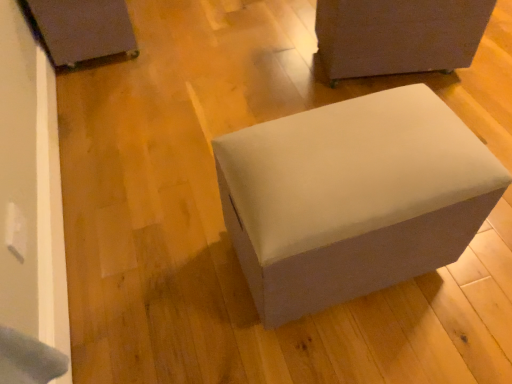
Measure the distance between matte black box at upper left, the first furniture in the left-to-right sequence, and camera.

They are 5.95 feet apart.

What do you see at coordinates (83, 29) in the screenshot?
I see `matte black box at upper left, acting as the third furniture starting from the right` at bounding box center [83, 29].

How much space does suede-like gray ottoman at center, placed as the 2th furniture when sorted from right to left, occupy horizontally?

26.04 inches.

What do you see at coordinates (352, 198) in the screenshot? I see `suede-like gray ottoman at center, placed as the 2th furniture when sorted from right to left` at bounding box center [352, 198].

Locate an element on the screen. matte gray ottoman at upper right, arranged as the 3th furniture when viewed from the left is located at coordinates (398, 35).

Identify the location of matte black box at upper left, the first furniture in the left-to-right sequence. This screenshot has height=384, width=512. (83, 29).

Which is more to the right, suede-like gray ottoman at center, placed as the 2th furniture when sorted from right to left, or matte black box at upper left, the first furniture in the left-to-right sequence?

Positioned to the right is suede-like gray ottoman at center, placed as the 2th furniture when sorted from right to left.

In the scene shown: From the image's perspective, is suede-like gray ottoman at center, which appears as the 2th furniture when viewed from the left, beneath matte black box at upper left, acting as the third furniture starting from the right?

Correct, suede-like gray ottoman at center, which appears as the 2th furniture when viewed from the left, appears lower than matte black box at upper left, acting as the third furniture starting from the right, in the image.

Is suede-like gray ottoman at center, placed as the 2th furniture when sorted from right to left, positioned far away from matte black box at upper left, acting as the third furniture starting from the right?

Yes.

Considering the positions of point (387, 245) and point (105, 2), is point (387, 245) closer or farther from the camera than point (105, 2)?

Clearly, point (387, 245) is closer to the camera than point (105, 2).

From a real-world perspective, which furniture is the 1st one underneath the suede-like gray ottoman at center, placed as the 2th furniture when sorted from right to left? Please provide its 2D coordinates.

[(398, 35)]

From a real-world perspective, which object stands above the other?

suede-like gray ottoman at center, which appears as the 2th furniture when viewed from the left.

Which object is closer to the camera, suede-like gray ottoman at center, placed as the 2th furniture when sorted from right to left, or matte gray ottoman at upper right, arranged as the 3th furniture when viewed from the left?

suede-like gray ottoman at center, placed as the 2th furniture when sorted from right to left, is in front.

Is suede-like gray ottoman at center, which appears as the 2th furniture when viewed from the left, far away from matte gray ottoman at upper right, the 1th furniture in the right-to-left sequence?

That's not correct — suede-like gray ottoman at center, which appears as the 2th furniture when viewed from the left, is a little close to matte gray ottoman at upper right, the 1th furniture in the right-to-left sequence.

How different are the orientations of matte gray ottoman at upper right, the 1th furniture in the right-to-left sequence, and suede-like gray ottoman at center, which appears as the 2th furniture when viewed from the left, in degrees?

There is a 105-degree angle between the facing directions of matte gray ottoman at upper right, the 1th furniture in the right-to-left sequence, and suede-like gray ottoman at center, which appears as the 2th furniture when viewed from the left.

Considering the sizes of objects matte gray ottoman at upper right, arranged as the 3th furniture when viewed from the left, and suede-like gray ottoman at center, placed as the 2th furniture when sorted from right to left, in the image provided, who is thinner, matte gray ottoman at upper right, arranged as the 3th furniture when viewed from the left, or suede-like gray ottoman at center, placed as the 2th furniture when sorted from right to left,?

matte gray ottoman at upper right, arranged as the 3th furniture when viewed from the left, is thinner.

From the image's perspective, between matte gray ottoman at upper right, the 1th furniture in the right-to-left sequence, and suede-like gray ottoman at center, which appears as the 2th furniture when viewed from the left, who is located below?

suede-like gray ottoman at center, which appears as the 2th furniture when viewed from the left, from the image's perspective.

Is matte gray ottoman at upper right, arranged as the 3th furniture when viewed from the left, aimed at suede-like gray ottoman at center, which appears as the 2th furniture when viewed from the left?

Yes, matte gray ottoman at upper right, arranged as the 3th furniture when viewed from the left, faces towards suede-like gray ottoman at center, which appears as the 2th furniture when viewed from the left.

From a real-world perspective, is matte black box at upper left, acting as the third furniture starting from the right, below suede-like gray ottoman at center, placed as the 2th furniture when sorted from right to left?

Yes, from a real-world perspective, matte black box at upper left, acting as the third furniture starting from the right, is below suede-like gray ottoman at center, placed as the 2th furniture when sorted from right to left.

Which is more to the left, matte black box at upper left, the first furniture in the left-to-right sequence, or suede-like gray ottoman at center, placed as the 2th furniture when sorted from right to left?

From the viewer's perspective, matte black box at upper left, the first furniture in the left-to-right sequence, appears more on the left side.

Is matte black box at upper left, the first furniture in the left-to-right sequence, not within suede-like gray ottoman at center, placed as the 2th furniture when sorted from right to left?

Indeed, matte black box at upper left, the first furniture in the left-to-right sequence, is completely outside suede-like gray ottoman at center, placed as the 2th furniture when sorted from right to left.

Is matte black box at upper left, acting as the third furniture starting from the right, thinner than suede-like gray ottoman at center, placed as the 2th furniture when sorted from right to left?

Yes.

Consider the image. Is matte black box at upper left, the first furniture in the left-to-right sequence, completely or partially outside of matte gray ottoman at upper right, the 1th furniture in the right-to-left sequence?

Yes, matte black box at upper left, the first furniture in the left-to-right sequence, is not within matte gray ottoman at upper right, the 1th furniture in the right-to-left sequence.

This screenshot has height=384, width=512. Identify the location of the 2nd furniture to the right of the matte black box at upper left, acting as the third furniture starting from the right, starting your count from the anchor. (398, 35).

From their relative heights in the image, would you say matte black box at upper left, acting as the third furniture starting from the right, is taller or shorter than matte gray ottoman at upper right, arranged as the 3th furniture when viewed from the left?

Considering their sizes, matte black box at upper left, acting as the third furniture starting from the right, has less height than matte gray ottoman at upper right, arranged as the 3th furniture when viewed from the left.

Can you confirm if matte black box at upper left, acting as the third furniture starting from the right, is smaller than matte gray ottoman at upper right, the 1th furniture in the right-to-left sequence?

Correct, matte black box at upper left, acting as the third furniture starting from the right, occupies less space than matte gray ottoman at upper right, the 1th furniture in the right-to-left sequence.

Looking at their sizes, would you say matte gray ottoman at upper right, the 1th furniture in the right-to-left sequence, is wider or thinner than matte black box at upper left, acting as the third furniture starting from the right?

In the image, matte gray ottoman at upper right, the 1th furniture in the right-to-left sequence, appears to be more narrow than matte black box at upper left, acting as the third furniture starting from the right.

Is matte gray ottoman at upper right, arranged as the 3th furniture when viewed from the left, directly adjacent to matte black box at upper left, the first furniture in the left-to-right sequence?

They are not placed beside each other.

From a real-world perspective, is matte gray ottoman at upper right, the 1th furniture in the right-to-left sequence, beneath matte black box at upper left, the first furniture in the left-to-right sequence?

No, from a real-world perspective, matte gray ottoman at upper right, the 1th furniture in the right-to-left sequence, is not below matte black box at upper left, the first furniture in the left-to-right sequence.

This screenshot has height=384, width=512. I want to click on furniture that is the 2nd one when counting downward from the matte black box at upper left, the first furniture in the left-to-right sequence (from the image's perspective), so click(352, 198).

From the matte gray ottoman at upper right, the 1th furniture in the right-to-left sequence, count the 1st furniture to the left and point to it. Please provide its 2D coordinates.

[(352, 198)]

Considering their positions, is matte black box at upper left, the first furniture in the left-to-right sequence, positioned further to suede-like gray ottoman at center, which appears as the 2th furniture when viewed from the left, than matte gray ottoman at upper right, the 1th furniture in the right-to-left sequence?

The object further to suede-like gray ottoman at center, which appears as the 2th furniture when viewed from the left, is matte black box at upper left, the first furniture in the left-to-right sequence.

From the image, which object appears to be farther from matte gray ottoman at upper right, the 1th furniture in the right-to-left sequence, matte black box at upper left, the first furniture in the left-to-right sequence, or suede-like gray ottoman at center, which appears as the 2th furniture when viewed from the left?

Among the two, matte black box at upper left, the first furniture in the left-to-right sequence, is located further to matte gray ottoman at upper right, the 1th furniture in the right-to-left sequence.

Looking at the image, which one is located closer to matte black box at upper left, the first furniture in the left-to-right sequence, suede-like gray ottoman at center, which appears as the 2th furniture when viewed from the left, or matte gray ottoman at upper right, arranged as the 3th furniture when viewed from the left?

matte gray ottoman at upper right, arranged as the 3th furniture when viewed from the left, is positioned closer to the anchor matte black box at upper left, the first furniture in the left-to-right sequence.

Based on the photo, which object lies nearer to the anchor point matte black box at upper left, the first furniture in the left-to-right sequence, matte gray ottoman at upper right, the 1th furniture in the right-to-left sequence, or suede-like gray ottoman at center, which appears as the 2th furniture when viewed from the left?

Among the two, matte gray ottoman at upper right, the 1th furniture in the right-to-left sequence, is located nearer to matte black box at upper left, the first furniture in the left-to-right sequence.

Based on their spatial positions, is matte gray ottoman at upper right, arranged as the 3th furniture when viewed from the left, or matte black box at upper left, the first furniture in the left-to-right sequence, closer to suede-like gray ottoman at center, placed as the 2th furniture when sorted from right to left?

The object closer to suede-like gray ottoman at center, placed as the 2th furniture when sorted from right to left, is matte gray ottoman at upper right, arranged as the 3th furniture when viewed from the left.

Which object lies further to the anchor point matte gray ottoman at upper right, arranged as the 3th furniture when viewed from the left, suede-like gray ottoman at center, placed as the 2th furniture when sorted from right to left, or matte black box at upper left, the first furniture in the left-to-right sequence?

Based on the image, matte black box at upper left, the first furniture in the left-to-right sequence, appears to be further to matte gray ottoman at upper right, arranged as the 3th furniture when viewed from the left.

Find the location of a particular element. Image resolution: width=512 pixels, height=384 pixels. furniture between matte black box at upper left, the first furniture in the left-to-right sequence, and matte gray ottoman at upper right, the 1th furniture in the right-to-left sequence, from left to right is located at coordinates (352, 198).